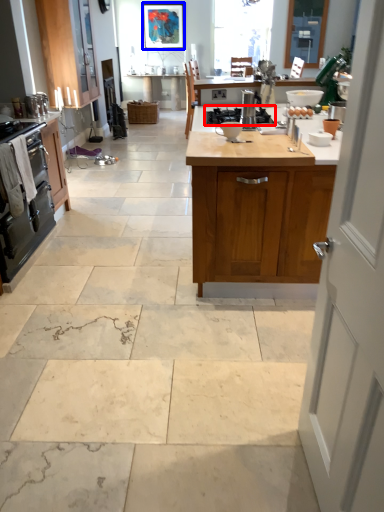
Question: Among these objects, which one is nearest to the camera, gas stove (highlighted by a red box) or picture frame (highlighted by a blue box)?

Choices:
 (A) gas stove
 (B) picture frame

Answer: (A)